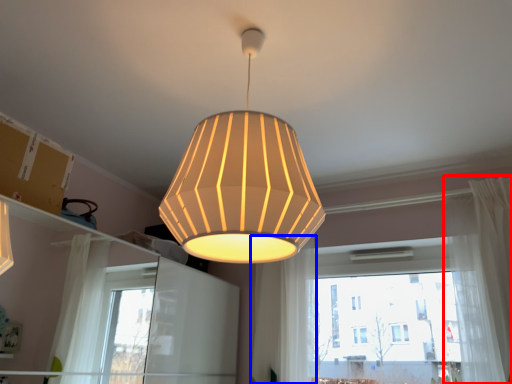
Question: Which point is closer to the camera, curtain (highlighted by a red box) or curtain (highlighted by a blue box)?

Choices:
 (A) curtain
 (B) curtain

Answer: (A)